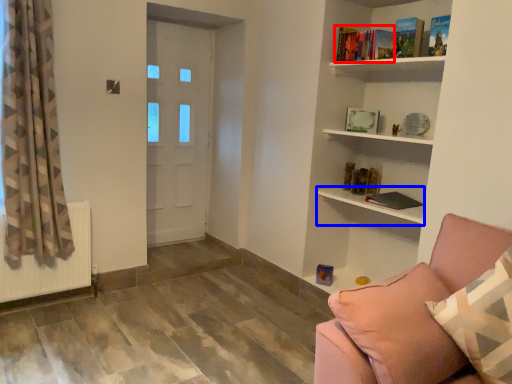
Question: Which of the following is the closest to the observer, book (highlighted by a red box) or shelf (highlighted by a blue box)?

Choices:
 (A) book
 (B) shelf

Answer: (B)